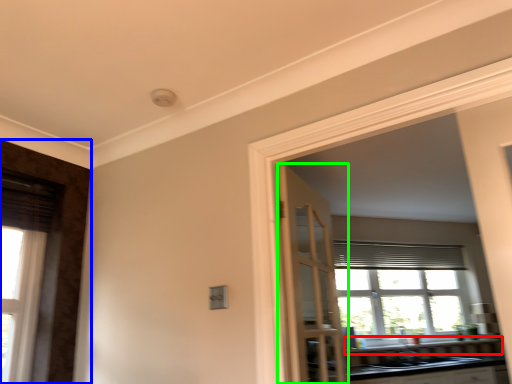
Question: Based on their relative distances, which object is nearer to window sill (highlighted by a red box)? Choose from door (highlighted by a blue box) and door (highlighted by a green box).

Choices:
 (A) door
 (B) door

Answer: (B)